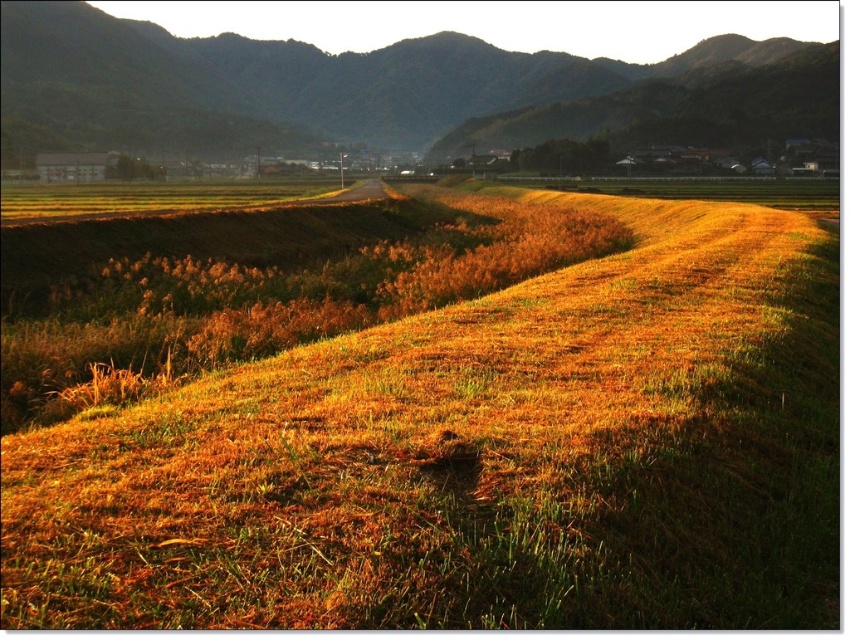
Measure the distance from golden grassy field at center to brown textured hillside at center.

A distance of 679.18 feet exists between golden grassy field at center and brown textured hillside at center.

Does point (816, 316) come in front of point (323, 96)?

Yes, point (816, 316) is in front of point (323, 96).

Find the location of `golden grassy field at center`. golden grassy field at center is located at coordinates (477, 458).